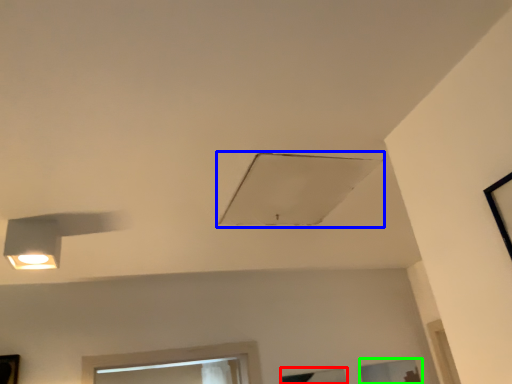
Question: Which is farther away from window (highlighted by a red box)? exhaust hood (highlighted by a blue box) or window (highlighted by a green box)?

Choices:
 (A) exhaust hood
 (B) window

Answer: (A)